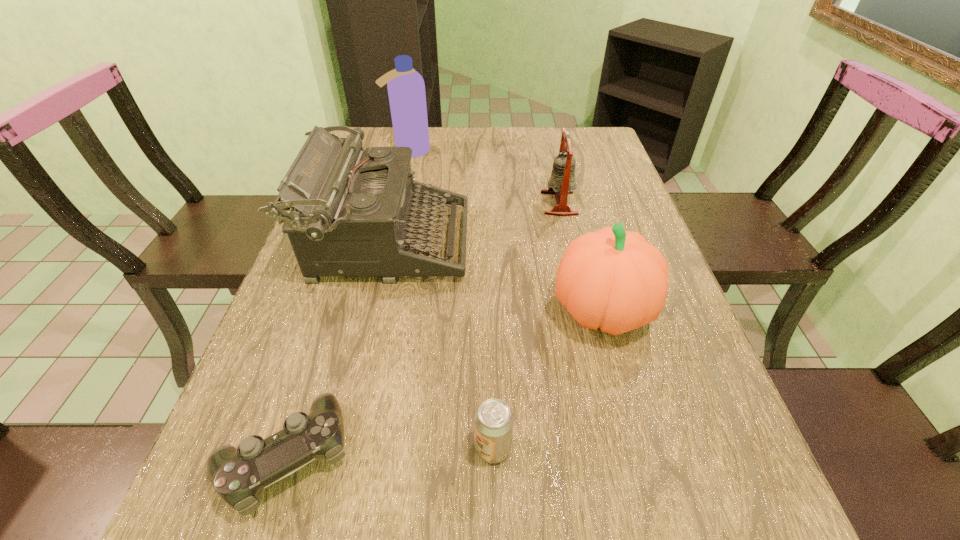
Locate an element on the screen. This screenshot has width=960, height=540. shampoo is located at coordinates (406, 89).

Where is `typewriter`? The height and width of the screenshot is (540, 960). typewriter is located at coordinates (353, 212).

This screenshot has width=960, height=540. In order to click on pumpkin in this screenshot , I will do `click(612, 279)`.

This screenshot has width=960, height=540. I want to click on bell, so click(562, 182).

Locate an element on the screen. the third object from right to left is located at coordinates (493, 421).

I want to click on the second shortest object, so click(x=493, y=421).

You are a GUI agent. You are given a task and a screenshot of the screen. Output one action in this format:
    pyautogui.click(x=<x>, y=<y>)
    Task: Click on the shortest object
    Image resolution: width=960 pixels, height=540 pixels.
    Given the screenshot: What is the action you would take?
    tap(238, 475)

What are the coordinates of `free space located 0.150m on the front of the shampoo` in the screenshot? It's located at (401, 186).

This screenshot has width=960, height=540. I want to click on vacant space located on the typing side of the typewriter, so click(x=543, y=243).

Find the location of a particular element. This screenshot has height=540, width=960. vacant space located 0.320m on the left of the pumpkin is located at coordinates (399, 310).